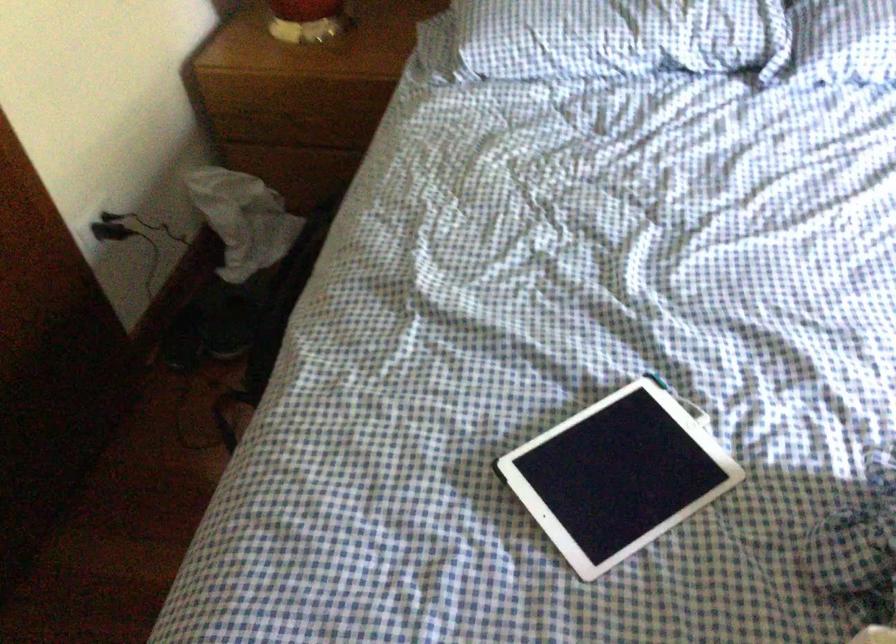
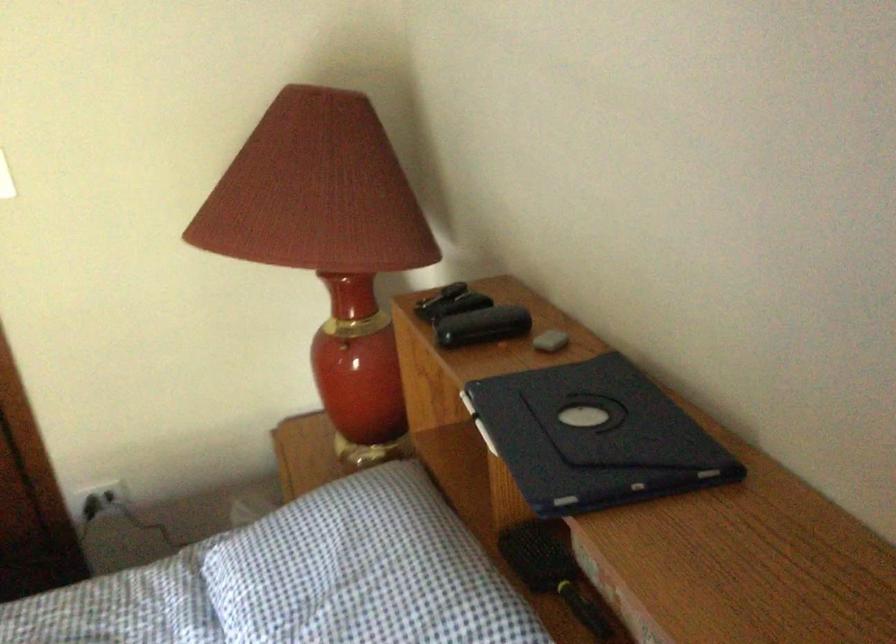
Locate, in the second image, the point that corresponds to (133,225) in the first image.

(99, 500)